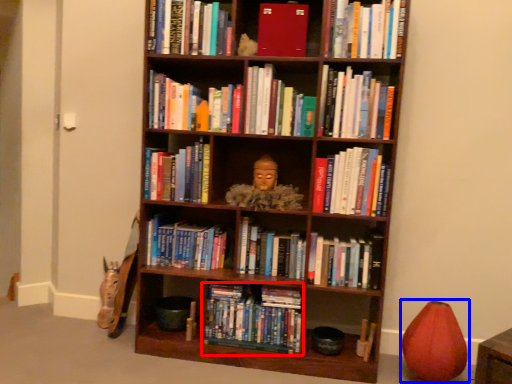
Question: Which object is further to the camera taking this photo, book (highlighted by a red box) or toy (highlighted by a blue box)?

Choices:
 (A) book
 (B) toy

Answer: (A)